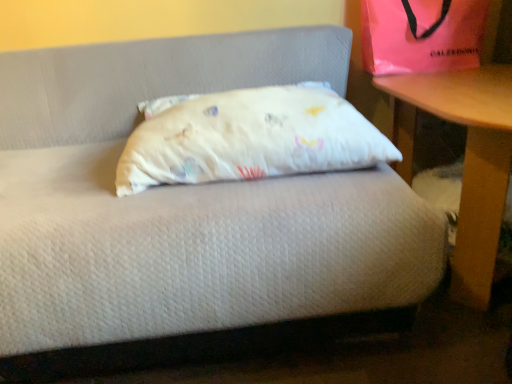
Question: Looking at the image, does white cotton pillow at center seem bigger or smaller compared to wooden table at right?

Choices:
 (A) big
 (B) small

Answer: (B)

Question: Which is correct: white cotton pillow at center is inside wooden table at right, or outside of it?

Choices:
 (A) outside
 (B) inside

Answer: (A)

Question: Considering the real-world distances, which object is closest to the wooden table at right?

Choices:
 (A) white cotton pillow at center
 (B) pink satin bag at upper right

Answer: (B)

Question: Estimate the real-world distances between objects in this image. Which object is farther from the wooden table at right?

Choices:
 (A) pink satin bag at upper right
 (B) white cotton pillow at center

Answer: (B)